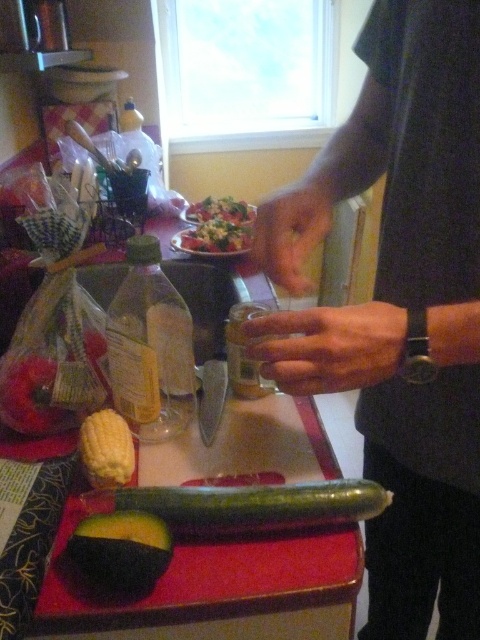
Question: Can you confirm if green matte avocado at lower left is smaller than yellow matte corn at lower left?

Choices:
 (A) no
 (B) yes

Answer: (B)

Question: Is green matte pickle at center positioned in front of shiny green salad at center?

Choices:
 (A) yes
 (B) no

Answer: (A)

Question: Based on their relative distances, which object is nearer to the yellow matte corn at lower left?

Choices:
 (A) green matte avocado at lower left
 (B) black fabric shirt at center

Answer: (A)

Question: Which point appears closest to the camera in this image?

Choices:
 (A) (287, 344)
 (B) (100, 483)
 (C) (320, 490)

Answer: (A)

Question: Which point is closer to the camera?

Choices:
 (A) (118, 456)
 (B) (204, 236)
 (C) (142, 580)
 (D) (342, 522)

Answer: (C)

Question: Is black fabric shirt at center to the right of yellow matte corn at lower left from the viewer's perspective?

Choices:
 (A) no
 (B) yes

Answer: (B)